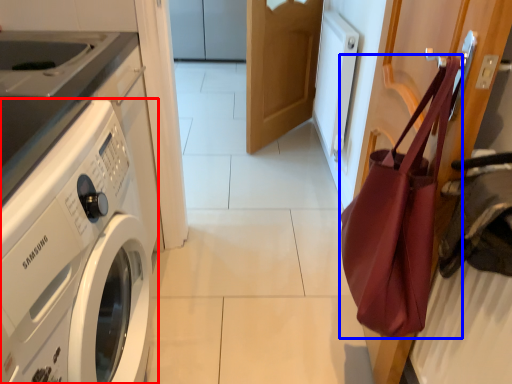
Question: Which of the following is the farthest to the observer, washing machine (highlighted by a red box) or tote bag (highlighted by a blue box)?

Choices:
 (A) washing machine
 (B) tote bag

Answer: (B)